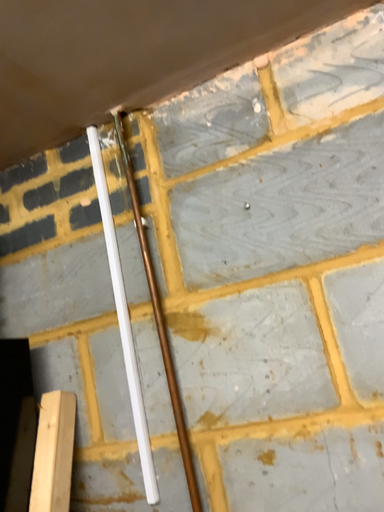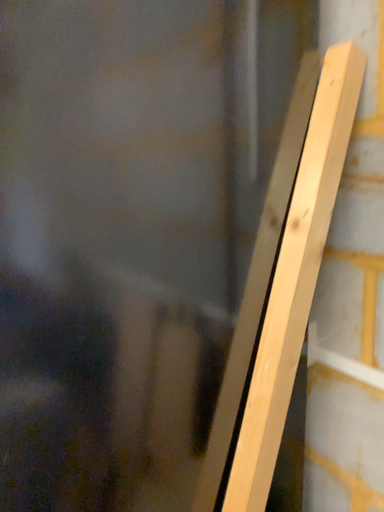
Question: How did the camera likely rotate when shooting the video?

Choices:
 (A) rotated downward
 (B) rotated upward

Answer: (A)